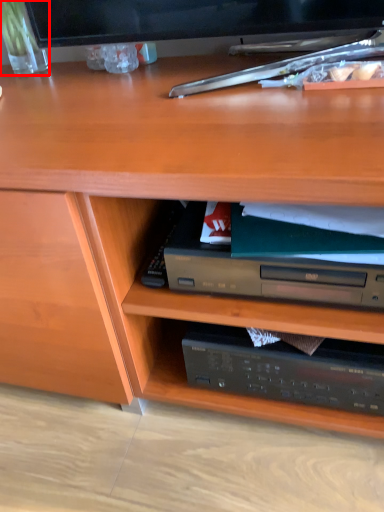
Question: Considering the relative positions of glass vase (annotated by the red box) and paperback book in the image provided, where is glass vase (annotated by the red box) located with respect to the staircase?

Choices:
 (A) left
 (B) right

Answer: (A)